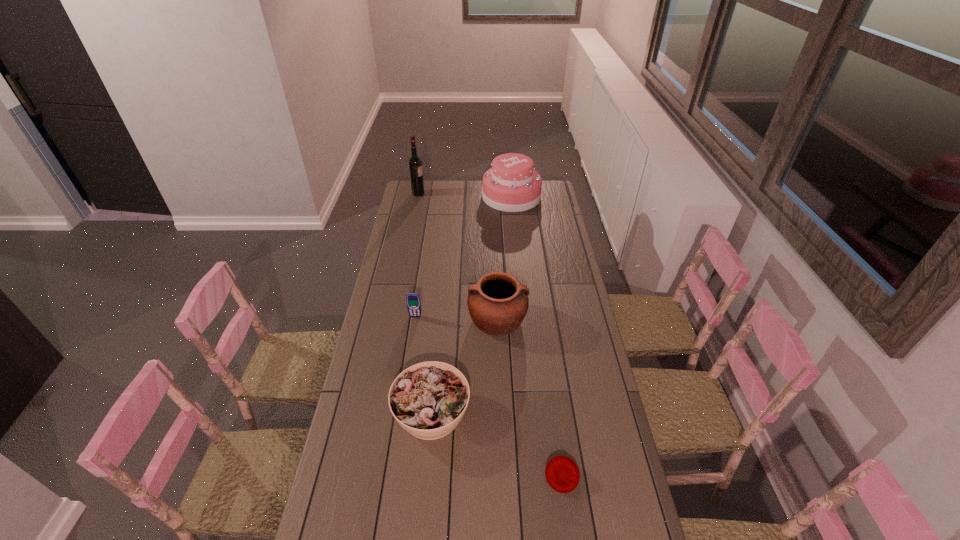
Image resolution: width=960 pixels, height=540 pixels. Identify the location of the tallest object. (415, 162).

Locate an element on the screen. the leftmost object is located at coordinates (415, 162).

This screenshot has height=540, width=960. I want to click on cake, so click(512, 185).

You are a GUI agent. You are given a task and a screenshot of the screen. Output one action in this format:
    pyautogui.click(x=<x>, y=<y>)
    Task: Click on the pottery
    
    Given the screenshot: What is the action you would take?
    pyautogui.click(x=498, y=303)

You are a GUI agent. You are given a task and a screenshot of the screen. Output one action in this format:
    pyautogui.click(x=<x>, y=<y>)
    Task: Click on the cellular telephone
    Image resolution: width=960 pixels, height=540 pixels.
    Given the screenshot: What is the action you would take?
    pyautogui.click(x=413, y=302)

Where is `salad`? salad is located at coordinates (429, 399).

Where is `the nearest object`? This screenshot has height=540, width=960. the nearest object is located at coordinates (562, 474).

Identify the location of beanbag. point(562,474).

Find the location of `vacant area situated on the front and back of the tallest object`. vacant area situated on the front and back of the tallest object is located at coordinates (452, 193).

The width and height of the screenshot is (960, 540). What are the coordinates of `free point located on the right of the second tallest object` in the screenshot? It's located at (555, 197).